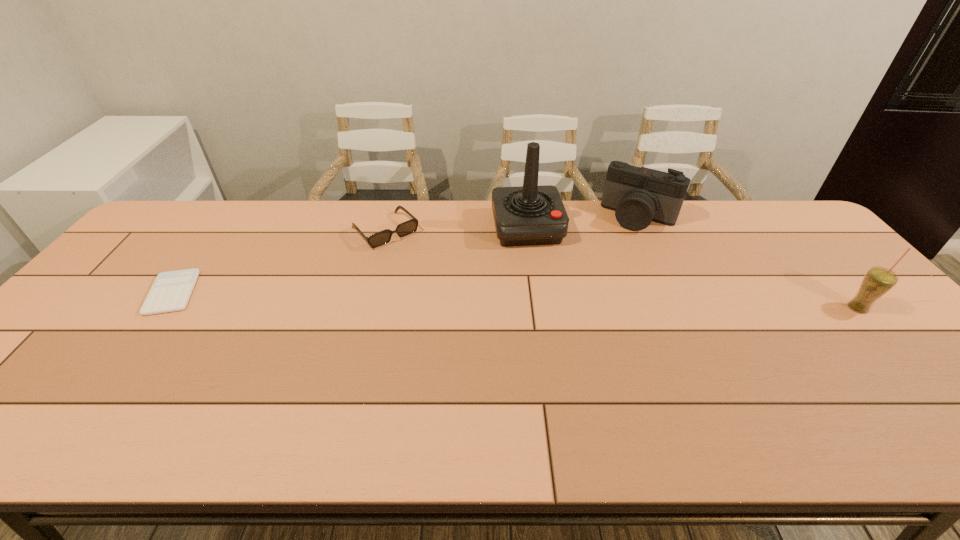
The width and height of the screenshot is (960, 540). Find the location of `free space located on the front-facing side of the third object from right to left`. free space located on the front-facing side of the third object from right to left is located at coordinates click(555, 334).

You are a GUI agent. You are given a task and a screenshot of the screen. Output one action in this format:
    pyautogui.click(x=<x>, y=<y>)
    Task: Click on the vacant space located 0.140m on the front-facing side of the third object from right to left
    
    Given the screenshot: What is the action you would take?
    pyautogui.click(x=540, y=280)

The height and width of the screenshot is (540, 960). Find the location of `vacant area located on the front-facing side of the third object from right to left`. vacant area located on the front-facing side of the third object from right to left is located at coordinates (537, 265).

In order to click on free space located 0.310m on the front-facing side of the second shortest object in this screenshot , I will do `click(459, 306)`.

Identify the location of blank area located on the front-facing side of the second shortest object. (435, 281).

You are a GUI agent. You are given a task and a screenshot of the screen. Output one action in this format:
    pyautogui.click(x=<x>, y=<y>)
    Task: Click on the vacant area situated on the front-facing side of the second shortest object
    This screenshot has height=540, width=960.
    Given the screenshot: What is the action you would take?
    [x=410, y=256]

Locate an element on the screen. The width and height of the screenshot is (960, 540). vacant space located at the lens of the camera is located at coordinates (616, 258).

What are the coordinates of `free space located at the lens of the camera` in the screenshot? It's located at (615, 259).

The width and height of the screenshot is (960, 540). Identify the location of vacant area situated 0.070m at the lens of the camera. (623, 245).

Identify the location of joystick positioned at the far edge. (527, 215).